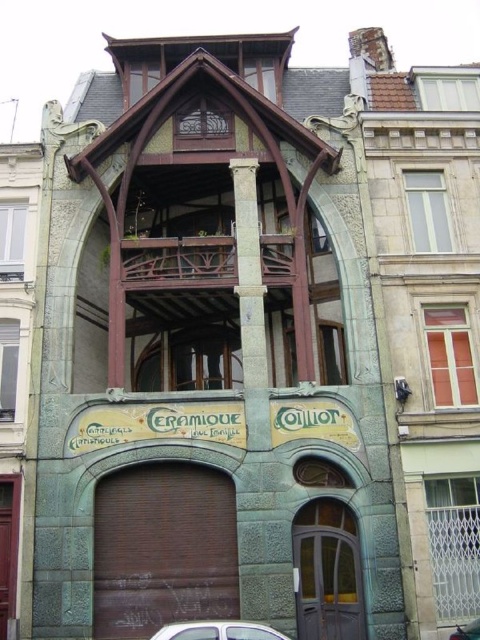
Question: Does brown matte door at center appear under metallic silver car at lower right?

Choices:
 (A) yes
 (B) no

Answer: (B)

Question: Which object appears closest to the camera in this image?

Choices:
 (A) green stone door at lower left
 (B) brown matte door at center
 (C) metallic silver car at lower right

Answer: (C)

Question: Is green stone door at lower left to the left of metallic silver car at lower right from the viewer's perspective?

Choices:
 (A) yes
 (B) no

Answer: (A)

Question: Which of the following is the closest to the observer?

Choices:
 (A) (351, 614)
 (B) (106, 605)
 (C) (6, 529)

Answer: (B)

Question: Does brown matte door at center appear on the left side of metallic silver car at lower right?

Choices:
 (A) yes
 (B) no

Answer: (A)

Question: Which of the following is the farthest from the observer?

Choices:
 (A) brown matte door at center
 (B) green stone door at lower left
 (C) green stone door at center

Answer: (C)